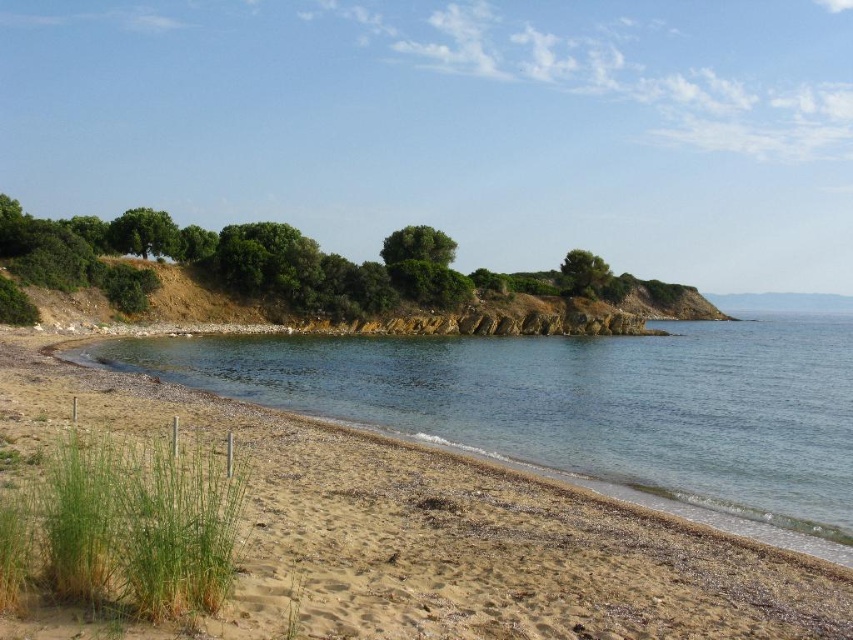
What do you see at coordinates (583, 406) in the screenshot? The image size is (853, 640). I see `clear water at lower left` at bounding box center [583, 406].

Looking at this image, does clear water at lower left appear under green leafy hillside at upper left?

Indeed, clear water at lower left is positioned under green leafy hillside at upper left.

Is point (503, 417) positioned after point (323, 259)?

No, it is not.

Locate an element on the screen. clear water at lower left is located at coordinates (583, 406).